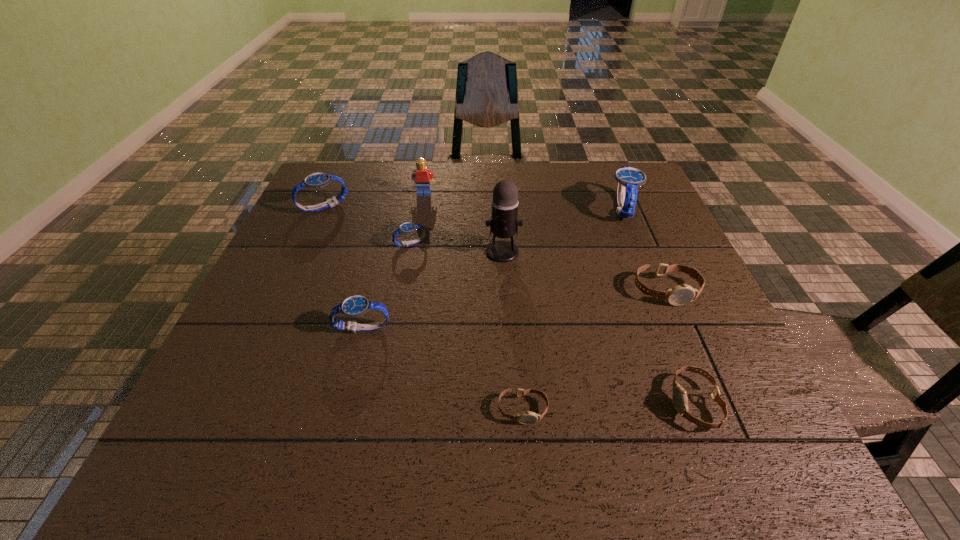
Identify the location of object that is at the far left corner. (316, 180).

Where is `object positioned at the far right corner`? This screenshot has height=540, width=960. object positioned at the far right corner is located at coordinates (629, 179).

Locate an element on the screen. object located in the near right corner section of the desktop is located at coordinates (680, 401).

Identify the location of free region at the far edge of the desktop. Image resolution: width=960 pixels, height=540 pixels. (396, 200).

This screenshot has width=960, height=540. Identify the location of vacant position at the near edge of the desktop. 485,463.

You are a GUI agent. You are given a task and a screenshot of the screen. Output one action in this format:
    pyautogui.click(x=<x>, y=<y>)
    Task: Click on the free space at the left edge of the desktop
    The width and height of the screenshot is (960, 540).
    Given the screenshot: What is the action you would take?
    pyautogui.click(x=322, y=213)

What are the coordinates of `free space at the right edge of the desktop` in the screenshot? It's located at (630, 234).

Locate an element on the screen. The height and width of the screenshot is (540, 960). vacant region at the near left corner is located at coordinates (194, 462).

The height and width of the screenshot is (540, 960). I want to click on vacant space at the near right corner of the desktop, so click(754, 437).

Where is `free area in between the third nearest watch and the tallest object`? free area in between the third nearest watch and the tallest object is located at coordinates (433, 290).